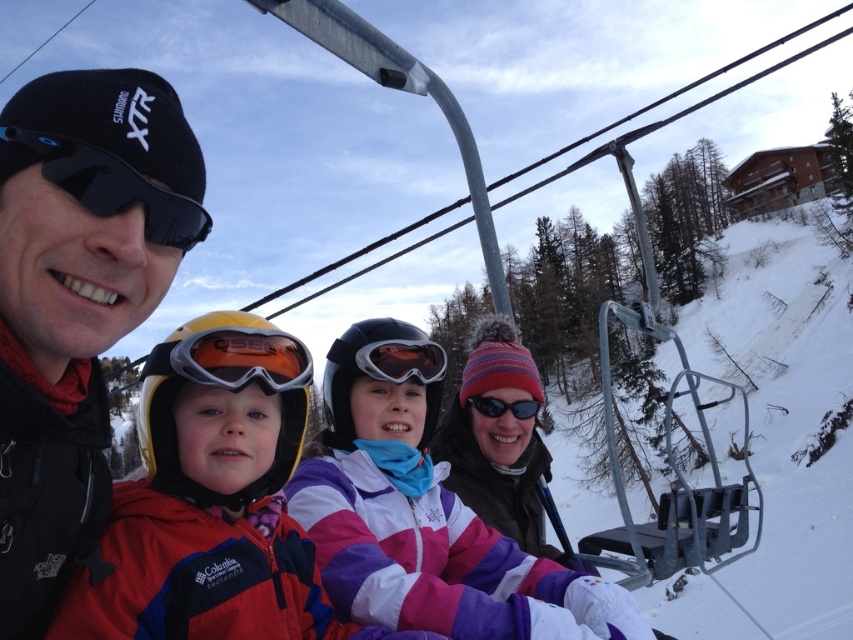
Is orange reflective goggles at center taller than black matte goggles at left?

Indeed, orange reflective goggles at center has a greater height compared to black matte goggles at left.

Is orange reflective goggles at center positioned before black matte goggles at left?

That is False.

Where is `orange reflective goggles at center`? Image resolution: width=853 pixels, height=640 pixels. orange reflective goggles at center is located at coordinates (213, 500).

Locate an element on the screen. orange reflective goggles at center is located at coordinates (213, 500).

Which of these two, orange reflective goggles at center or matte black goggles at center, stands shorter?

matte black goggles at center

From the picture: Can you confirm if orange reflective goggles at center is positioned above matte black goggles at center?

No, orange reflective goggles at center is not above matte black goggles at center.

Is point (260, 502) behind point (378, 362)?

No.

Locate an element on the screen. The height and width of the screenshot is (640, 853). orange reflective goggles at center is located at coordinates (213, 500).

Between black matte goggles at left and black matte goggles at center, which one is positioned higher?

black matte goggles at left is above.

Can you confirm if black matte goggles at left is shorter than black matte goggles at center?

Incorrect, black matte goggles at left's height does not fall short of black matte goggles at center's.

Between point (187, 237) and point (508, 404), which one is positioned in front?

Point (187, 237) is more forward.

The image size is (853, 640). What are the coordinates of `black matte goggles at left` in the screenshot? It's located at (113, 188).